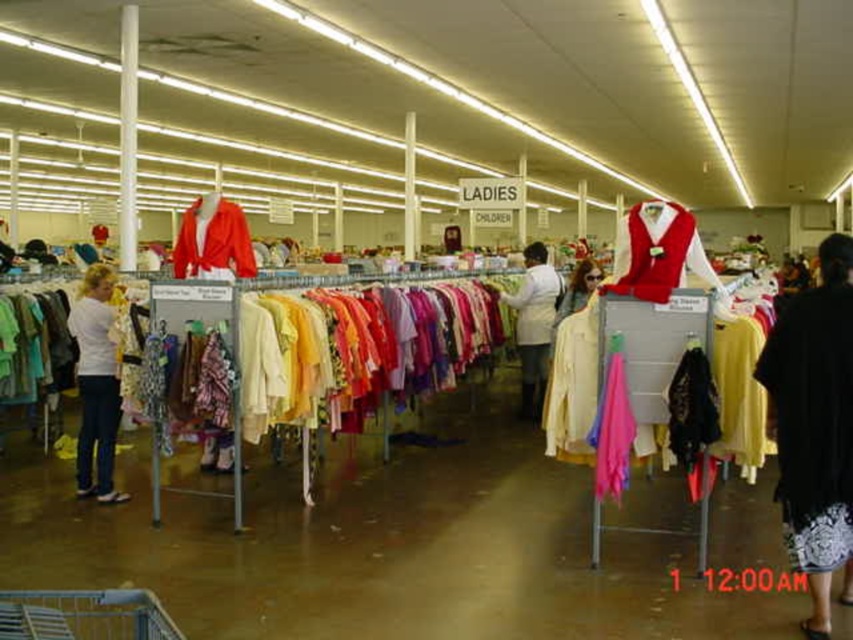
You are a customer in a thrift store and see two jackets at the center of the rack. The velvet red vest at center and the white matte jacket at center. Which one is positioned to the right?

The velvet red vest at center is positioned to the right of the white matte jacket at center.

You are standing in the thrift store and want to reach both the point at coordinates (77, 467) and the point at coordinates (552, 333). Which point will you reach first?

You will reach the point at coordinates (77, 467) first because it is closer to you than the point at coordinates (552, 333).

You are a customer in the thrift store and want to decide between the white matte shirt at left and the white matte jacket at center. Which one is smaller in size?

The white matte shirt at left is smaller than the white matte jacket at center.